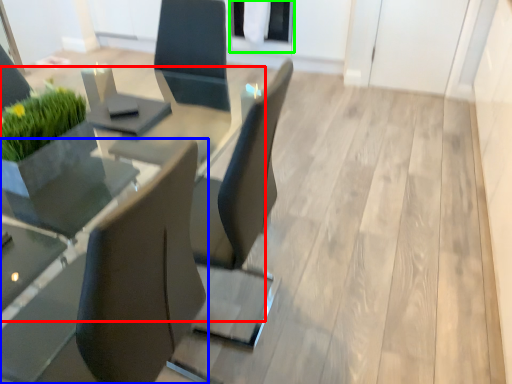
Question: Estimate the real-world distances between objects in this image. Which object is farther from round table (highlighted by a red box), chair (highlighted by a blue box) or glass door (highlighted by a green box)?

Choices:
 (A) chair
 (B) glass door

Answer: (B)